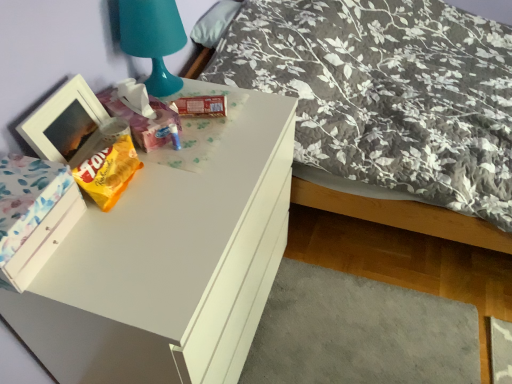
Image resolution: width=512 pixels, height=384 pixels. Identify the location of vacant area that lies in front of matte plastic tissue box at upper center, which is the 1th package in left-to-right order. (166, 174).